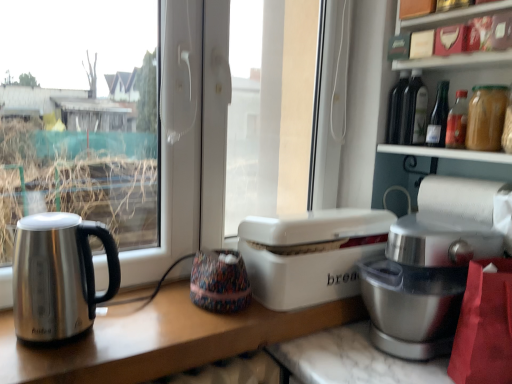
The image size is (512, 384). What do you see at coordinates (438, 117) in the screenshot? I see `translucent glass bottle at upper right, marked as the first bottle in a back-to-front arrangement` at bounding box center [438, 117].

Locate an element on the screen. matte glass bottles at upper right is located at coordinates (462, 70).

Image resolution: width=512 pixels, height=384 pixels. Describe the element at coordinates (310, 254) in the screenshot. I see `white plastic bread bin at center` at that location.

What do you see at coordinates (486, 117) in the screenshot?
I see `translucent glass bottle at upper right, placed as the first bottle when sorted from front to back` at bounding box center [486, 117].

Locate an element on the screen. The height and width of the screenshot is (384, 512). stainless steel kettle at left is located at coordinates (58, 275).

Locate an element on the screen. The height and width of the screenshot is (384, 512). translucent glass bottle at upper right, arranged as the second bottle when viewed from the front is located at coordinates (438, 117).

Considering the relative positions of matte glass bottles at upper right and white paper at right in the image provided, is matte glass bottles at upper right to the left of white paper at right from the viewer's perspective?

Yes, matte glass bottles at upper right is to the left of white paper at right.

Is matte glass bottles at upper right positioned with its back to white paper at right?

No.

Would you say matte glass bottles at upper right contains white paper at right?

No.

Is stainless steel kettle at left wider or thinner than white paper at right?

Considering their sizes, stainless steel kettle at left looks broader than white paper at right.

In the scene shown: From the image's perspective, between stainless steel kettle at left and white paper at right, which one is located above?

white paper at right.

Find the location of a particular element. kettle that appears below the white paper at right (from a real-world perspective) is located at coordinates (58, 275).

Consider the image. Considering the relative sizes of stainless steel kettle at left and white paper at right in the image provided, is stainless steel kettle at left shorter than white paper at right?

Incorrect, the height of stainless steel kettle at left does not fall short of that of white paper at right.

Which of these two, translucent glass bottle at upper right, which is the second bottle in back-to-front order, or stainless steel kettle at left, is thinner?

With smaller width is translucent glass bottle at upper right, which is the second bottle in back-to-front order.

Measure the distance from translucent glass bottle at upper right, placed as the first bottle when sorted from front to back, to stainless steel kettle at left.

translucent glass bottle at upper right, placed as the first bottle when sorted from front to back, and stainless steel kettle at left are 37.79 inches apart.

This screenshot has height=384, width=512. I want to click on kettle below the translucent glass bottle at upper right, placed as the first bottle when sorted from front to back (from the image's perspective), so click(58, 275).

From the image's perspective, is translucent glass bottle at upper right, which is the second bottle in back-to-front order, located above or below stainless steel kettle at left?

translucent glass bottle at upper right, which is the second bottle in back-to-front order, is above stainless steel kettle at left.

Is satin silver mixer at right positioned far away from white plastic bread bin at center?

satin silver mixer at right is actually quite close to white plastic bread bin at center.

Does point (368, 311) lie in front of point (388, 225)?

Yes, it is in front of point (388, 225).

From the image's perspective, which is above, satin silver mixer at right or white plastic bread bin at center?

white plastic bread bin at center.

Which of these two, satin silver mixer at right or white plastic bread bin at center, is wider?

With larger width is white plastic bread bin at center.

Is matte glass bottles at upper right not inside stainless steel kettle at left?

Absolutely, matte glass bottles at upper right is external to stainless steel kettle at left.

Could you tell me if matte glass bottles at upper right is turned towards stainless steel kettle at left?

Yes, matte glass bottles at upper right is oriented towards stainless steel kettle at left.

Considering the points (428, 86) and (42, 229), which point is in front, point (428, 86) or point (42, 229)?

The point (42, 229) is in front.

Based on the photo, from a real-world perspective, is matte glass bottles at upper right located beneath stainless steel kettle at left?

Actually, matte glass bottles at upper right is physically above stainless steel kettle at left in the real world.

From the image's perspective, between white paper at right and translucent glass bottle at upper right, placed as the first bottle when sorted from front to back, who is located below?

white paper at right, from the image's perspective.

Could translucent glass bottle at upper right, which is the second bottle in back-to-front order, be considered to be inside white paper at right?

Definitely not — translucent glass bottle at upper right, which is the second bottle in back-to-front order, is not inside white paper at right.

Is point (431, 182) positioned in front of point (473, 147)?

No.

In the scene shown: Who is more distant, white paper at right or translucent glass bottle at upper right, placed as the first bottle when sorted from front to back?

white paper at right.

Who is shorter, white plastic bread bin at center or white paper at right?

Standing shorter between the two is white paper at right.

Does white plastic bread bin at center have a smaller size compared to white paper at right?

No.

Considering the relative positions of white plastic bread bin at center and white paper at right in the image provided, is white plastic bread bin at center to the right of white paper at right from the viewer's perspective?

In fact, white plastic bread bin at center is to the left of white paper at right.

Locate an element on the screen. The width and height of the screenshot is (512, 384). shelf above the white paper at right (from a real-world perspective) is located at coordinates click(x=462, y=70).

At what (x,y) coordinates should I click in order to perform the action: click on kettle on the left side of white paper at right. Please return your answer as a coordinate pair (x, y). The height and width of the screenshot is (384, 512). Looking at the image, I should click on (58, 275).

Considering their positions, is white paper at right positioned further to translucent glass bottle at upper right, arranged as the second bottle when viewed from the front, than matte glass bottles at upper right?

white paper at right is further to translucent glass bottle at upper right, arranged as the second bottle when viewed from the front.

Based on the photo, looking at the image, which one is located further to translucent glass bottle at upper right, placed as the first bottle when sorted from front to back, white plastic bread bin at center or white paper at right?

white plastic bread bin at center.

From the image, which object appears to be nearer to white plastic bread bin at center, matte glass bottles at upper right or translucent glass bottle at upper right, marked as the first bottle in a back-to-front arrangement?

translucent glass bottle at upper right, marked as the first bottle in a back-to-front arrangement, lies closer to white plastic bread bin at center than the other object.

Based on their spatial positions, is translucent glass bottle at upper right, placed as the first bottle when sorted from front to back, or translucent glass bottle at upper right, marked as the first bottle in a back-to-front arrangement, further from white paper at right?

The object further to white paper at right is translucent glass bottle at upper right, marked as the first bottle in a back-to-front arrangement.

Based on the photo, based on their spatial positions, is satin silver mixer at right or white plastic bread bin at center closer to translucent glass bottle at upper right, arranged as the second bottle when viewed from the front?

Based on the image, satin silver mixer at right appears to be nearer to translucent glass bottle at upper right, arranged as the second bottle when viewed from the front.

Estimate the real-world distances between objects in this image. Which object is closer to matte glass bottles at upper right, white plastic bread bin at center or translucent glass bottle at upper right, which is the second bottle in back-to-front order?

translucent glass bottle at upper right, which is the second bottle in back-to-front order, is closer to matte glass bottles at upper right.

From the image, which object appears to be farther from translucent glass bottle at upper right, placed as the first bottle when sorted from front to back, white plastic bread bin at center or stainless steel kettle at left?

The object further to translucent glass bottle at upper right, placed as the first bottle when sorted from front to back, is stainless steel kettle at left.

Based on the photo, which object lies nearer to the anchor point translucent glass bottle at upper right, placed as the first bottle when sorted from front to back, white plastic bread bin at center or translucent glass bottle at upper right, arranged as the second bottle when viewed from the front?

Based on the image, translucent glass bottle at upper right, arranged as the second bottle when viewed from the front, appears to be nearer to translucent glass bottle at upper right, placed as the first bottle when sorted from front to back.

The width and height of the screenshot is (512, 384). I want to click on paper towel between matte glass bottles at upper right and white plastic bread bin at center vertically, so click(459, 196).

The image size is (512, 384). I want to click on paper towel between stainless steel kettle at left and translucent glass bottle at upper right, placed as the first bottle when sorted from front to back, from left to right, so click(459, 196).

In order to click on bottle between translucent glass bottle at upper right, marked as the first bottle in a back-to-front arrangement, and white paper at right in the up-down direction in this screenshot , I will do `click(486, 117)`.

This screenshot has height=384, width=512. I want to click on bottle between stainless steel kettle at left and translucent glass bottle at upper right, placed as the first bottle when sorted from front to back, so click(x=438, y=117).